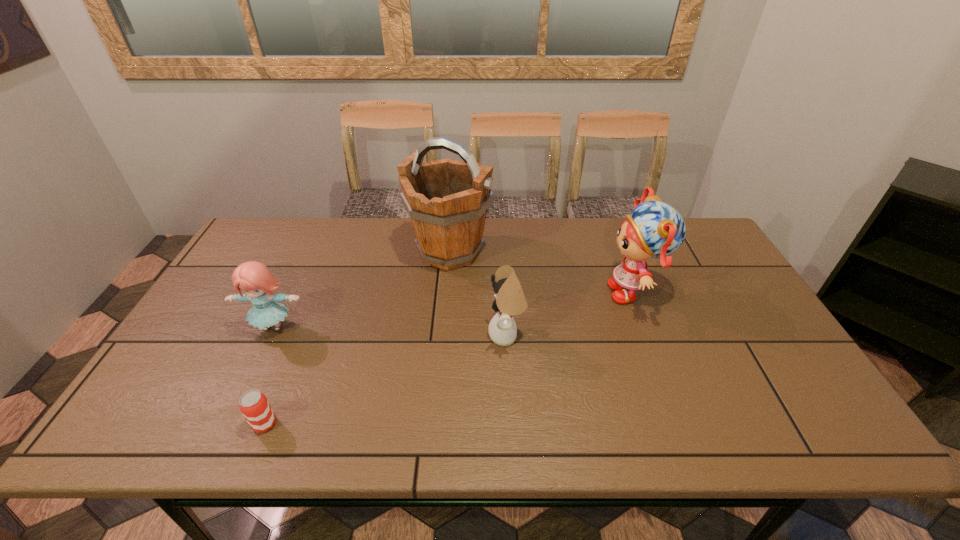
Locate an element on the screen. free space between the bucket and the second doll from left to right is located at coordinates (478, 293).

Locate an element on the screen. The width and height of the screenshot is (960, 540). vacant point located between the leftmost doll and the second doll from left to right is located at coordinates (390, 331).

Locate an element on the screen. The height and width of the screenshot is (540, 960). vacant point located between the shortest object and the leftmost doll is located at coordinates (269, 375).

Identify the location of free point between the tallest doll and the leftmost doll. pyautogui.click(x=453, y=309).

Where is `vacant area that lies between the bucket and the nearest object`? This screenshot has height=540, width=960. vacant area that lies between the bucket and the nearest object is located at coordinates (357, 338).

Identify the location of object that stands as the fourth closest to the bucket. (253, 404).

At what (x,y) coordinates should I click in order to perform the action: click on object that is the nearest to the second doll from left to right. Please return your answer as a coordinate pair (x, y). The height and width of the screenshot is (540, 960). Looking at the image, I should click on (447, 200).

Locate an element on the screen. This screenshot has height=540, width=960. doll that stands as the closest to the second doll from right to left is located at coordinates (654, 229).

You are a GUI agent. You are given a task and a screenshot of the screen. Output one action in this format:
    pyautogui.click(x=<x>, y=<y>)
    Task: Click on the doll that is the second closest to the bucket
    The width and height of the screenshot is (960, 540).
    Given the screenshot: What is the action you would take?
    pyautogui.click(x=256, y=281)

Locate an element on the screen. free point that satisfies the following two spatial constraints: 1. on the front-facing side of the nearest object; 2. on the left side of the leftmost doll is located at coordinates (228, 424).